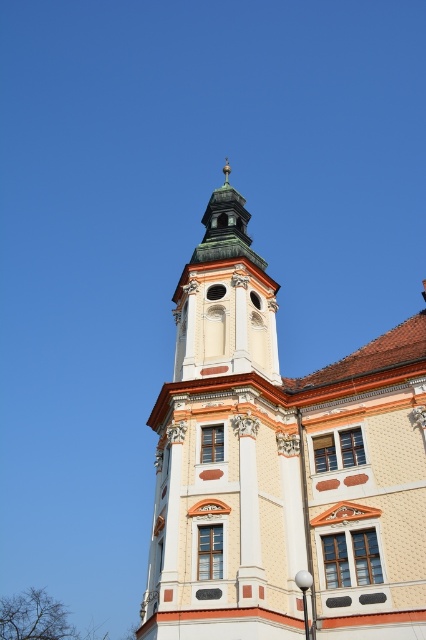
You are an architect analyzing the building structure. Based on the image, which of the two towers, the white stone tower at center or the green copper bell tower at upper center, has a greater height?

The white stone tower at center is taller than the green copper bell tower at upper center according to the description provided.

You are a drone operator tasked with capturing aerial footage of the white stone tower at center. The drone has a maximum flight distance of 25 meters. Can the drone safely reach the tower without exceeding its range limit?

The white stone tower at center is 23.23 meters from camera. Since the drone can fly up to 25 meters, it can safely reach the tower without exceeding its range limit.

You are an architect analyzing the building layout. You need to determine the vertical arrangement of the white stone tower at center and the green copper bell tower at upper center. Which one is positioned higher in the structure?

The white stone tower at center is positioned higher than the green copper bell tower at upper center according to the description.